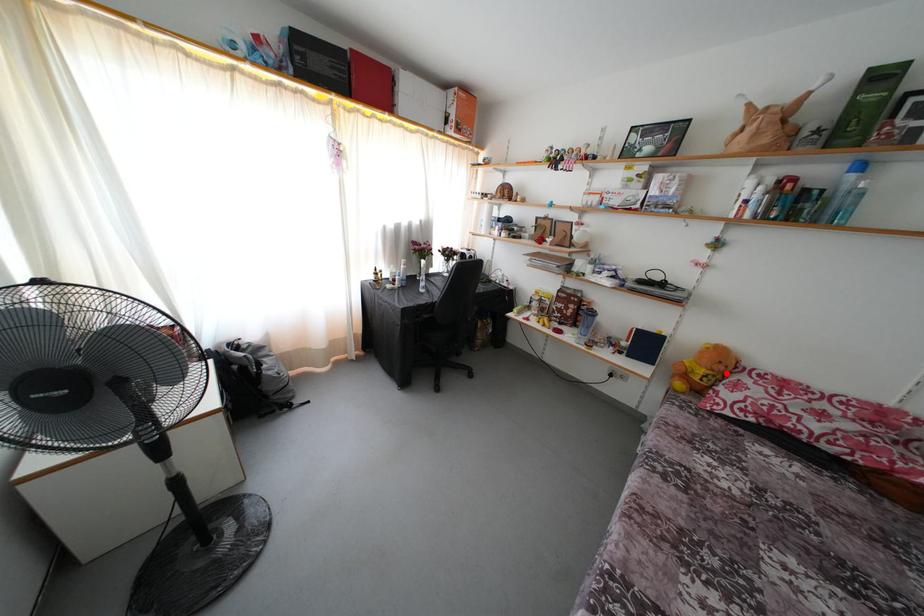
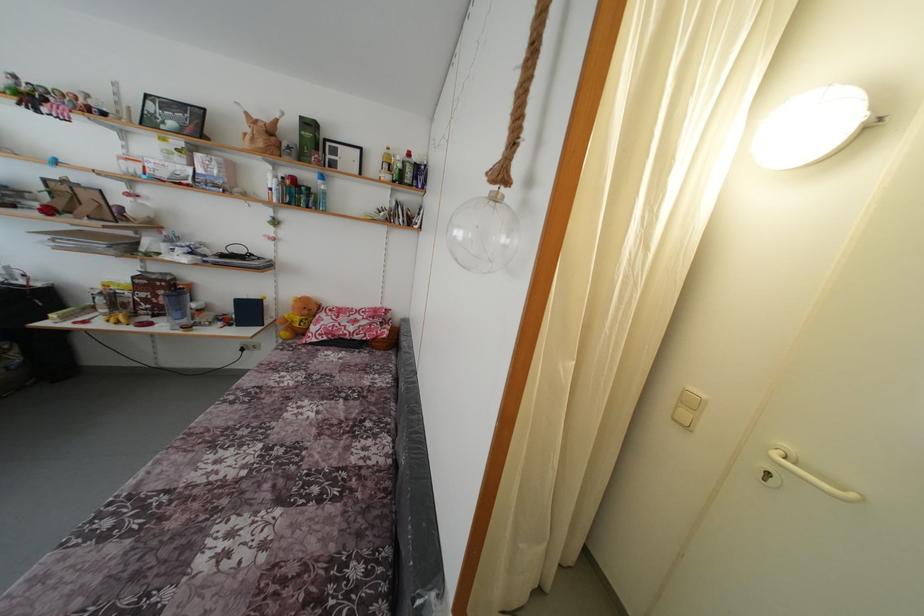
Where in the second image is the point corresponding to the highlighted location from the first image?

(310, 317)